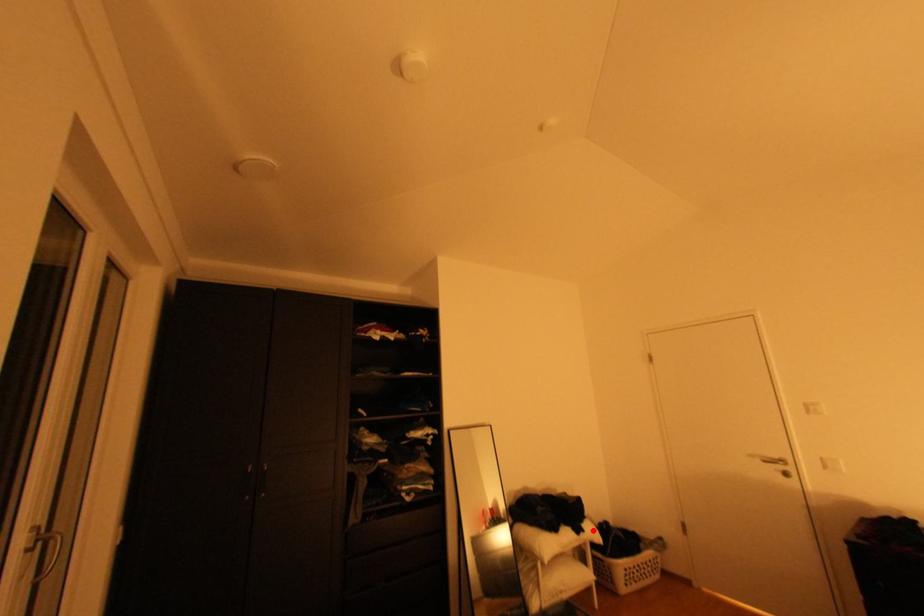
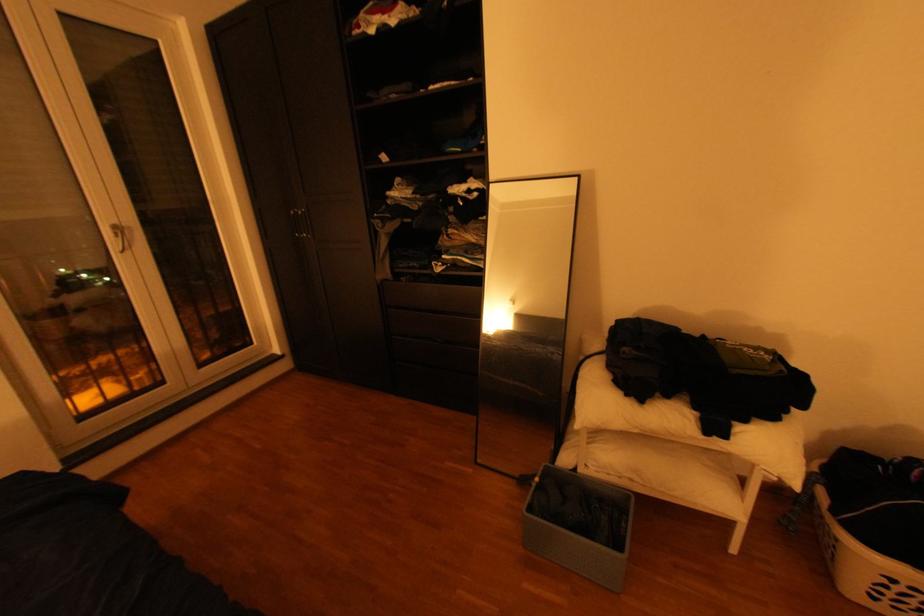
Question: I am providing you with two images of the same scene from different viewpoints. In image1, a red point is highlighted. Considering the same 3D point in image2, which of the following is correct?

Choices:
 (A) It is closer
 (B) It is farther

Answer: (A)